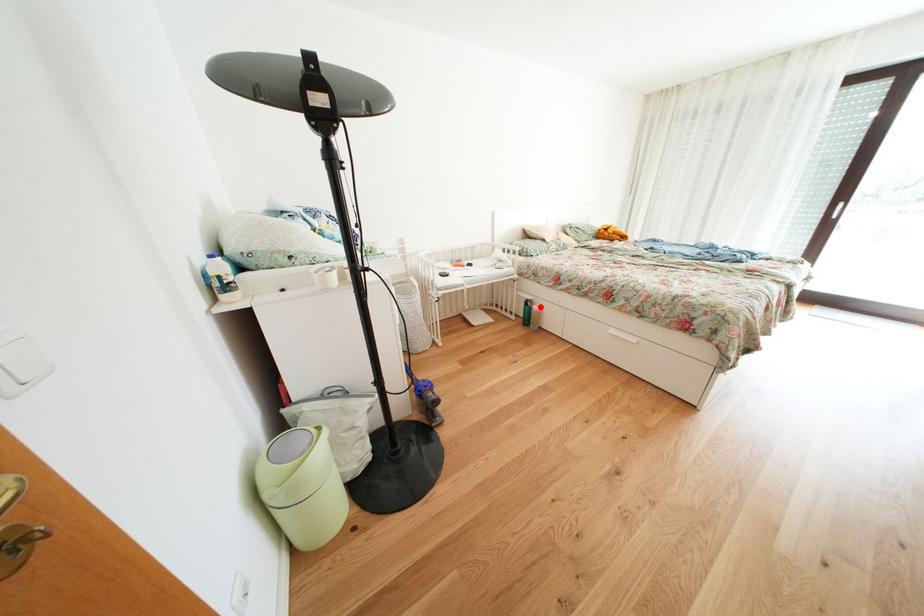
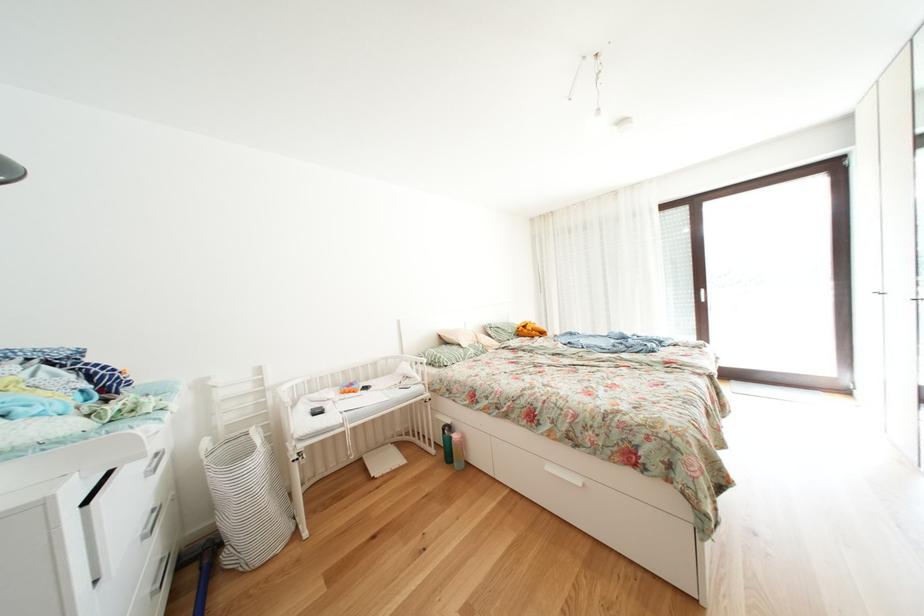
Question: I am providing you with two images of the same scene from different viewpoints. In image1, a red point is highlighted. Considering the same 3D point in image2, which of the following is correct?

Choices:
 (A) It is closer
 (B) It is farther

Answer: (B)